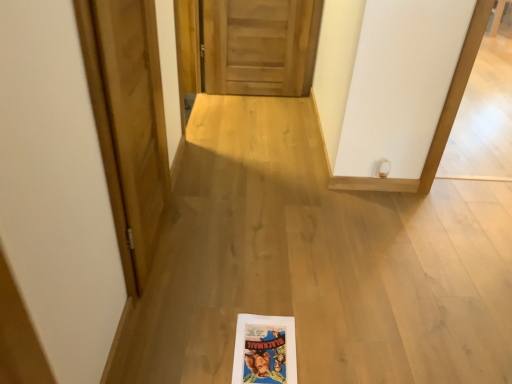
What do you see at coordinates (260, 46) in the screenshot? I see `wooden at center, positioned as the 1th door in back-to-front order` at bounding box center [260, 46].

Where is `wooden at center, which is counted as the 1th door, starting from the right`? The height and width of the screenshot is (384, 512). wooden at center, which is counted as the 1th door, starting from the right is located at coordinates (260, 46).

In order to face wooden door at left, which ranks as the first door in bottom-to-top order, should I rotate leftwards or rightwards?

To face it directly, rotate left by 14.391 degrees.

Find the location of `wooden door at left, the 2th door in the top-to-bottom sequence`. wooden door at left, the 2th door in the top-to-bottom sequence is located at coordinates (130, 121).

The width and height of the screenshot is (512, 384). Describe the element at coordinates (130, 121) in the screenshot. I see `wooden door at left, which ranks as the first door in left-to-right order` at that location.

The width and height of the screenshot is (512, 384). I want to click on wooden at center, the 2th door when ordered from bottom to top, so click(260, 46).

Which is more to the left, wooden door at left, which ranks as the first door in bottom-to-top order, or wooden at center, which is the second door from left to right?

wooden door at left, which ranks as the first door in bottom-to-top order.

Is wooden door at left, which ranks as the first door in left-to-right order, behind wooden at center, the 2th door positioned from the front?

No, wooden door at left, which ranks as the first door in left-to-right order, is closer to the camera.

Which is closer, (115, 207) or (309, 9)?

Clearly, point (115, 207) is closer to the camera than point (309, 9).

From the image's perspective, is wooden door at left, the second door viewed from the right, located above wooden at center, the 2th door when ordered from bottom to top?

Actually, wooden door at left, the second door viewed from the right, appears below wooden at center, the 2th door when ordered from bottom to top, in the image.

From a real-world perspective, between wooden door at left, acting as the 1th door starting from the front, and wooden at center, which ranks as the first door in top-to-bottom order, who is vertically lower?

wooden at center, which ranks as the first door in top-to-bottom order, from a real-world perspective.

Does wooden door at left, acting as the 1th door starting from the front, have a greater width compared to wooden at center, positioned as the 1th door in back-to-front order?

In fact, wooden door at left, acting as the 1th door starting from the front, might be narrower than wooden at center, positioned as the 1th door in back-to-front order.

Can you confirm if wooden door at left, which is counted as the second door, starting from the back, is taller than wooden at center, which is counted as the 1th door, starting from the right?

Yes, wooden door at left, which is counted as the second door, starting from the back, is taller than wooden at center, which is counted as the 1th door, starting from the right.

Considering the sizes of objects wooden door at left, the 2th door in the top-to-bottom sequence, and wooden at center, which ranks as the first door in top-to-bottom order, in the image provided, who is smaller, wooden door at left, the 2th door in the top-to-bottom sequence, or wooden at center, which ranks as the first door in top-to-bottom order,?

With smaller size is wooden door at left, the 2th door in the top-to-bottom sequence.

Is wooden door at left, the 2th door in the top-to-bottom sequence, inside or outside of wooden at center, which is the second door from left to right?

wooden door at left, the 2th door in the top-to-bottom sequence, cannot be found inside wooden at center, which is the second door from left to right.

Would you consider wooden door at left, which is counted as the second door, starting from the back, to be distant from wooden at center, which is the second door from left to right?

wooden door at left, which is counted as the second door, starting from the back, is far away from wooden at center, which is the second door from left to right.

Is wooden door at left, the 2th door in the top-to-bottom sequence, turned away from wooden at center, the 2th door positioned from the front?

No, wooden at center, the 2th door positioned from the front, is not at the back of wooden door at left, the 2th door in the top-to-bottom sequence.

How different are the orientations of wooden door at left, the 2th door in the top-to-bottom sequence, and wooden at center, which is the second door from left to right, in degrees?

The angle between the facing direction of wooden door at left, the 2th door in the top-to-bottom sequence, and the facing direction of wooden at center, which is the second door from left to right, is 88.1 degrees.

Measure the distance between wooden door at left, which is counted as the second door, starting from the back, and wooden at center, which is counted as the 1th door, starting from the right.

5.10 feet.

The image size is (512, 384). In order to click on door above the wooden door at left, which ranks as the first door in bottom-to-top order (from the image's perspective) in this screenshot , I will do `click(260, 46)`.

Considering the positions of objects wooden at center, the 2th door when ordered from bottom to top, and wooden door at left, the 2th door in the top-to-bottom sequence, in the image provided, who is more to the right, wooden at center, the 2th door when ordered from bottom to top, or wooden door at left, the 2th door in the top-to-bottom sequence,?

wooden at center, the 2th door when ordered from bottom to top.

Relative to wooden door at left, which ranks as the first door in bottom-to-top order, is wooden at center, positioned as the 1th door in back-to-front order, in front or behind?

Visually, wooden at center, positioned as the 1th door in back-to-front order, is located behind wooden door at left, which ranks as the first door in bottom-to-top order.

Which is in front, point (241, 63) or point (152, 240)?

The point (152, 240) is in front.

Consider the image. From the image's perspective, which is above, wooden at center, which is counted as the 1th door, starting from the right, or wooden door at left, which ranks as the first door in bottom-to-top order?

wooden at center, which is counted as the 1th door, starting from the right, is shown above in the image.

From a real-world perspective, is wooden at center, the 2th door when ordered from bottom to top, on wooden door at left, which is counted as the second door, starting from the back?

Incorrect, from a real-world perspective, wooden at center, the 2th door when ordered from bottom to top, is lower than wooden door at left, which is counted as the second door, starting from the back.

Which object is wider, wooden at center, which is counted as the 1th door, starting from the right, or wooden door at left, which ranks as the first door in left-to-right order?

wooden at center, which is counted as the 1th door, starting from the right, is wider.

Does wooden at center, the 2th door positioned from the front, have a greater height compared to wooden door at left, the second door viewed from the right?

In fact, wooden at center, the 2th door positioned from the front, may be shorter than wooden door at left, the second door viewed from the right.

Between wooden at center, which is the second door from left to right, and wooden door at left, acting as the 1th door starting from the front, which one has smaller size?

Smaller between the two is wooden door at left, acting as the 1th door starting from the front.

Is wooden door at left, which is counted as the second door, starting from the back, completely or partially inside wooden at center, the 2th door when ordered from bottom to top?

No, wooden door at left, which is counted as the second door, starting from the back, is not a part of wooden at center, the 2th door when ordered from bottom to top.

Is wooden at center, the 2th door when ordered from bottom to top, next to wooden door at left, which ranks as the first door in left-to-right order, and touching it?

There is a gap between wooden at center, the 2th door when ordered from bottom to top, and wooden door at left, which ranks as the first door in left-to-right order.

Does wooden at center, which is counted as the 1th door, starting from the right, turn towards wooden door at left, acting as the 1th door starting from the front?

Yes, wooden at center, which is counted as the 1th door, starting from the right, faces towards wooden door at left, acting as the 1th door starting from the front.

How many degrees apart are the facing directions of wooden at center, the 2th door positioned from the front, and wooden door at left, which is counted as the second door, starting from the back?

They differ by 88.1 degrees in their facing directions.

How distant is wooden at center, positioned as the 1th door in back-to-front order, from wooden door at left, the 2th door in the top-to-bottom sequence?

They are 5.10 feet apart.

Identify the location of door located underneath the wooden door at left, which is counted as the second door, starting from the back (from a real-world perspective). (260, 46).

At what (x,y) coordinates should I click in order to perform the action: click on door above the wooden door at left, acting as the 1th door starting from the front (from the image's perspective). Please return your answer as a coordinate pair (x, y). Looking at the image, I should click on (260, 46).

I want to click on door to the left of wooden at center, which ranks as the first door in top-to-bottom order, so tap(130, 121).